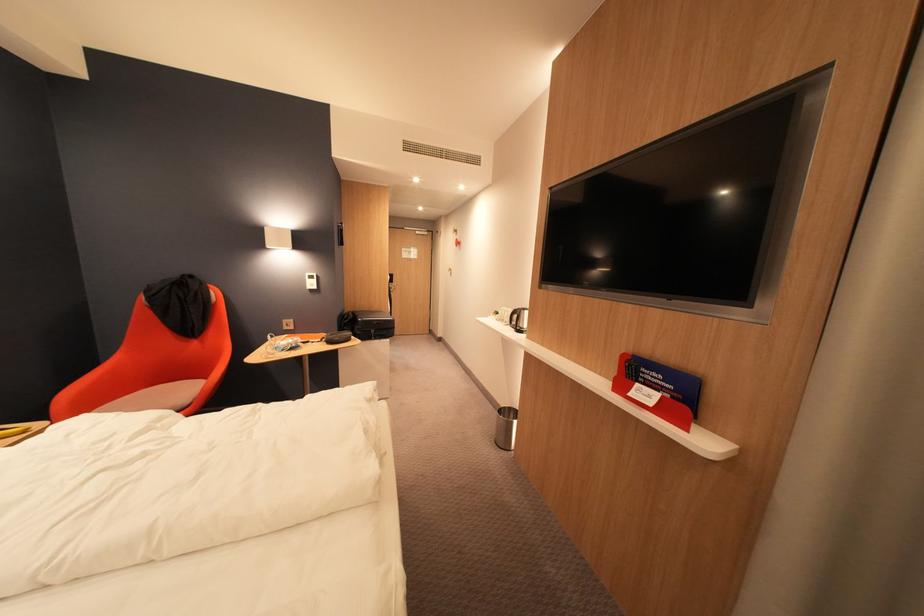
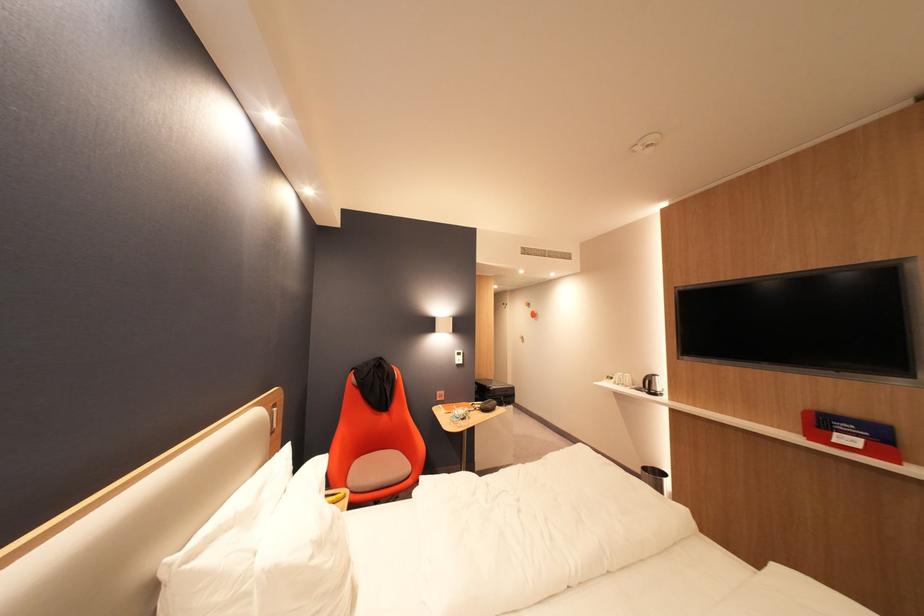
Locate, in the second image, the point that corresponds to pixel 648 386 in the first image.

(846, 435)